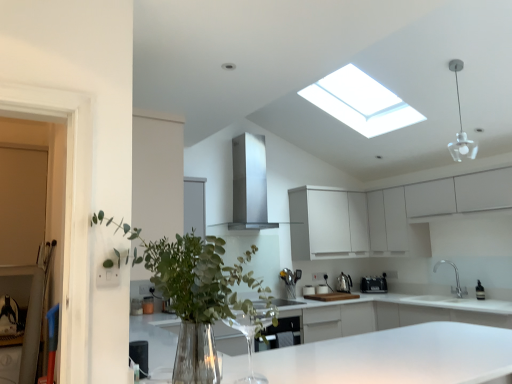
The image size is (512, 384). What do you see at coordinates (344, 283) in the screenshot?
I see `polished stainless steel kettle at center, placed as the second appliance when sorted from right to left` at bounding box center [344, 283].

Find the location of a particular element. white glossy countertop at center is located at coordinates coord(392,314).

Identify the location of green leafy plant at center. (199, 294).

Where is `white plastic toaster at center, the first appliance when ordered from left to right`? The height and width of the screenshot is (384, 512). white plastic toaster at center, the first appliance when ordered from left to right is located at coordinates (321, 289).

Locate an element on the screen. This screenshot has width=512, height=384. white matte cabinet at upper center, which appears as the first cabinetry when viewed from the back is located at coordinates (328, 223).

Considering the relative sizes of white glass pendant light at upper right and polished stainless steel kettle at center, which is the second appliance in left-to-right order, in the image provided, is white glass pendant light at upper right bigger than polished stainless steel kettle at center, which is the second appliance in left-to-right order,?

No.

From a real-world perspective, between white glass pendant light at upper right and polished stainless steel kettle at center, placed as the second appliance when sorted from right to left, who is vertically lower?

From a 3D spatial view, polished stainless steel kettle at center, placed as the second appliance when sorted from right to left, is below.

From the image's perspective, is white glass pendant light at upper right above or below polished stainless steel kettle at center, which is the second appliance in left-to-right order?

Clearly, from the image's perspective, white glass pendant light at upper right is above polished stainless steel kettle at center, which is the second appliance in left-to-right order.

From the image's perspective, which one is positioned lower, metallic silver toaster at lower center, which is counted as the first appliance, starting from the right, or white matte cabinetry at upper right, which is counted as the first cabinetry, starting from the front?

metallic silver toaster at lower center, which is counted as the first appliance, starting from the right.

Is metallic silver toaster at lower center, which is counted as the first appliance, starting from the right, positioned far away from white matte cabinetry at upper right, which is counted as the first cabinetry, starting from the front?

metallic silver toaster at lower center, which is counted as the first appliance, starting from the right, is near white matte cabinetry at upper right, which is counted as the first cabinetry, starting from the front, not far away.

Does point (374, 288) come farther from viewer compared to point (441, 195)?

That is True.

Does point (384, 276) come closer to viewer compared to point (343, 192)?

Yes, it is in front of point (343, 192).

Does metallic silver toaster at lower center, which is counted as the first appliance, starting from the right, touch white matte cabinet at upper center, acting as the second cabinetry starting from the front?

No, metallic silver toaster at lower center, which is counted as the first appliance, starting from the right, is not making contact with white matte cabinet at upper center, acting as the second cabinetry starting from the front.

Considering the sizes of objects metallic silver toaster at lower center, acting as the third appliance starting from the left, and white matte cabinet at upper center, acting as the second cabinetry starting from the front, in the image provided, who is shorter, metallic silver toaster at lower center, acting as the third appliance starting from the left, or white matte cabinet at upper center, acting as the second cabinetry starting from the front,?

metallic silver toaster at lower center, acting as the third appliance starting from the left, is shorter.

Can you tell me how much metallic silver toaster at lower center, acting as the third appliance starting from the left, and white matte cabinet at upper center, which appears as the first cabinetry when viewed from the back, differ in facing direction?

metallic silver toaster at lower center, acting as the third appliance starting from the left, and white matte cabinet at upper center, which appears as the first cabinetry when viewed from the back, are facing 42.3 degrees away from each other.

Considering the sizes of white glass pendant light at upper right and silver metallic faucet at lower right in the image, is white glass pendant light at upper right taller or shorter than silver metallic faucet at lower right?

white glass pendant light at upper right is taller than silver metallic faucet at lower right.

From a real-world perspective, is white glass pendant light at upper right positioned over silver metallic faucet at lower right based on gravity?

Correct, in the physical world, white glass pendant light at upper right is higher than silver metallic faucet at lower right.

Are white glass pendant light at upper right and silver metallic faucet at lower right located far from each other?

Yes.

Image resolution: width=512 pixels, height=384 pixels. I want to click on tap below the white glass pendant light at upper right (from the image's perspective), so click(455, 275).

Does white glass pendant light at upper right have a lesser height compared to white glossy countertop at center?

Yes.

Can you confirm if white glass pendant light at upper right is bigger than white glossy countertop at center?

No, white glass pendant light at upper right is not bigger than white glossy countertop at center.

From the picture: Between white glass pendant light at upper right and white glossy countertop at center, which one appears on the left side from the viewer's perspective?

From the viewer's perspective, white glossy countertop at center appears more on the left side.

Does point (470, 148) appear closer or farther from the camera than point (387, 309)?

Point (470, 148) appears to be closer to the viewer than point (387, 309).

Considering the sizes of objects silver metallic faucet at lower right and polished stainless steel kettle at center, which is the second appliance in left-to-right order, in the image provided, who is bigger, silver metallic faucet at lower right or polished stainless steel kettle at center, which is the second appliance in left-to-right order,?

With larger size is silver metallic faucet at lower right.

Is silver metallic faucet at lower right outside of polished stainless steel kettle at center, placed as the second appliance when sorted from right to left?

That's correct, silver metallic faucet at lower right is outside of polished stainless steel kettle at center, placed as the second appliance when sorted from right to left.

Considering the positions of objects silver metallic faucet at lower right and polished stainless steel kettle at center, which is the second appliance in left-to-right order, in the image provided, who is in front, silver metallic faucet at lower right or polished stainless steel kettle at center, which is the second appliance in left-to-right order,?

silver metallic faucet at lower right is more forward.

The image size is (512, 384). I want to click on the 2nd cabinetry behind the white glossy countertop at center, starting your count from the anchor, so click(x=328, y=223).

Considering the relative positions of white matte cabinet at upper center, which appears as the first cabinetry when viewed from the back, and white glossy countertop at center in the image provided, is white matte cabinet at upper center, which appears as the first cabinetry when viewed from the back, to the right of white glossy countertop at center from the viewer's perspective?

Correct, you'll find white matte cabinet at upper center, which appears as the first cabinetry when viewed from the back, to the right of white glossy countertop at center.

Is the surface of white matte cabinet at upper center, acting as the second cabinetry starting from the front, in direct contact with white glossy countertop at center?

There is a gap between white matte cabinet at upper center, acting as the second cabinetry starting from the front, and white glossy countertop at center.

Locate an element on the screen. The height and width of the screenshot is (384, 512). light fixture lying above the polished stainless steel kettle at center, placed as the second appliance when sorted from right to left (from the image's perspective) is located at coordinates (461, 125).

The image size is (512, 384). In order to click on the 2nd appliance positioned below the white matte cabinetry at upper right, which is counted as the first cabinetry, starting from the front (from a real-world perspective) in this screenshot , I will do `click(374, 284)`.

Estimate the real-world distances between objects in this image. Which object is further from green leafy plant at center, stainless steel exhaust hood at center or white matte cabinet at upper center, acting as the second cabinetry starting from the front?

The object further to green leafy plant at center is white matte cabinet at upper center, acting as the second cabinetry starting from the front.

Consider the image. When comparing their distances from white matte cabinet at upper center, acting as the second cabinetry starting from the front, does metallic silver toaster at lower center, acting as the third appliance starting from the left, or polished stainless steel kettle at center, placed as the second appliance when sorted from right to left, seem further?

metallic silver toaster at lower center, acting as the third appliance starting from the left, is further to white matte cabinet at upper center, acting as the second cabinetry starting from the front.

Based on their spatial positions, is metallic silver toaster at lower center, acting as the third appliance starting from the left, or green leafy plant at center further from white matte cabinet at upper center, which appears as the first cabinetry when viewed from the back?

green leafy plant at center is further to white matte cabinet at upper center, which appears as the first cabinetry when viewed from the back.

Looking at this image, looking at the image, which one is located closer to white matte cabinet at upper center, acting as the second cabinetry starting from the front, white matte cabinetry at upper right, which is counted as the first cabinetry, starting from the front, or white glass pendant light at upper right?

Among the two, white matte cabinetry at upper right, which is counted as the first cabinetry, starting from the front, is located nearer to white matte cabinet at upper center, acting as the second cabinetry starting from the front.

Looking at the image, which one is located further to metallic silver toaster at lower center, which is counted as the first appliance, starting from the right, white glass pendant light at upper right or white matte cabinetry at upper right, marked as the second cabinetry in a back-to-front arrangement?

Based on the image, white glass pendant light at upper right appears to be further to metallic silver toaster at lower center, which is counted as the first appliance, starting from the right.

Based on their spatial positions, is white glossy countertop at center or silver metallic faucet at lower right closer to white glass pendant light at upper right?

white glossy countertop at center is positioned closer to the anchor white glass pendant light at upper right.

Estimate the real-world distances between objects in this image. Which object is closer to white plastic toaster at center, the 3th appliance positioned from the right, white glossy countertop at center or silver metallic faucet at lower right?

Among the two, white glossy countertop at center is located nearer to white plastic toaster at center, the 3th appliance positioned from the right.

Looking at the image, which one is located further to polished stainless steel kettle at center, placed as the second appliance when sorted from right to left, white matte cabinetry at upper right, marked as the second cabinetry in a back-to-front arrangement, or white matte cabinet at upper center, which appears as the first cabinetry when viewed from the back?

white matte cabinetry at upper right, marked as the second cabinetry in a back-to-front arrangement, is positioned further to the anchor polished stainless steel kettle at center, placed as the second appliance when sorted from right to left.

The width and height of the screenshot is (512, 384). What are the coordinates of `tap between white matte cabinetry at upper right, which is counted as the first cabinetry, starting from the front, and polished stainless steel kettle at center, which is the second appliance in left-to-right order, along the z-axis` in the screenshot? It's located at (455, 275).

Identify the location of light fixture between white glossy countertop at center and metallic silver toaster at lower center, acting as the third appliance starting from the left, in the front-back direction. The image size is (512, 384). (461, 125).

Where is `tap between white matte cabinetry at upper right, marked as the second cabinetry in a back-to-front arrangement, and white matte cabinet at upper center, which appears as the first cabinetry when viewed from the back, along the z-axis`? The width and height of the screenshot is (512, 384). tap between white matte cabinetry at upper right, marked as the second cabinetry in a back-to-front arrangement, and white matte cabinet at upper center, which appears as the first cabinetry when viewed from the back, along the z-axis is located at coordinates (455, 275).

Where is `cabinetry between green leafy plant at center and white glass pendant light at upper right in the front-back direction`? cabinetry between green leafy plant at center and white glass pendant light at upper right in the front-back direction is located at coordinates (386, 214).